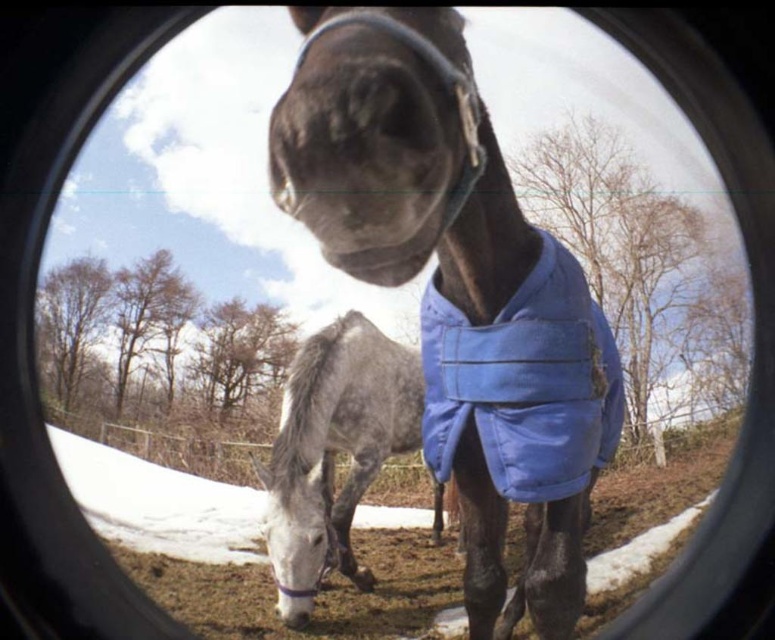
Question: Which object is positioned closest to the shiny blue blanket at center?

Choices:
 (A) blue fabric at center
 (B) gray speckled coat at center

Answer: (A)

Question: Is blue fabric at center to the left of gray speckled coat at center from the viewer's perspective?

Choices:
 (A) no
 (B) yes

Answer: (A)

Question: Considering the real-world distances, which object is closest to the shiny blue blanket at center?

Choices:
 (A) gray speckled coat at center
 (B) blue fabric at center

Answer: (B)

Question: Is shiny blue blanket at center above blue fabric at center?

Choices:
 (A) yes
 (B) no

Answer: (A)

Question: Which is nearer to the shiny blue blanket at center?

Choices:
 (A) gray speckled coat at center
 (B) blue fabric at center

Answer: (B)

Question: Considering the relative positions of shiny blue blanket at center and gray speckled coat at center in the image provided, where is shiny blue blanket at center located with respect to gray speckled coat at center?

Choices:
 (A) below
 (B) above

Answer: (B)